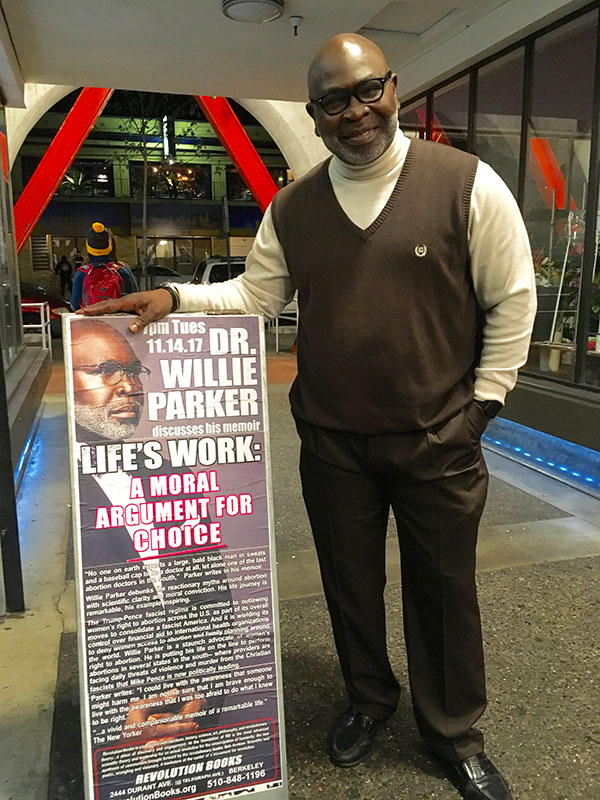
The height and width of the screenshot is (800, 600). Find the location of `gray and white pebble floor`. gray and white pebble floor is located at coordinates (335, 668).